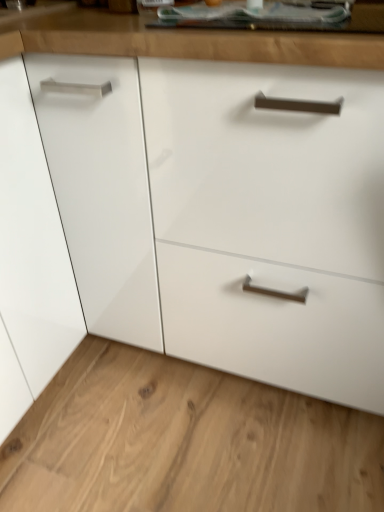
Question: Should I look upward or downward to see glossy wood counter top at upper center?

Choices:
 (A) up
 (B) down

Answer: (A)

Question: Can you confirm if glossy wood counter top at upper center is taller than white glossy drawer at lower right?

Choices:
 (A) no
 (B) yes

Answer: (B)

Question: From a real-world perspective, is glossy wood counter top at upper center located higher than white glossy drawer at lower right?

Choices:
 (A) yes
 (B) no

Answer: (A)

Question: Are glossy wood counter top at upper center and white glossy drawer at lower right far apart?

Choices:
 (A) no
 (B) yes

Answer: (A)

Question: From the image's perspective, is glossy wood counter top at upper center located beneath white glossy drawer at lower right?

Choices:
 (A) yes
 (B) no

Answer: (B)

Question: Is glossy wood counter top at upper center shorter than white glossy drawer at lower right?

Choices:
 (A) yes
 (B) no

Answer: (B)

Question: From the image's perspective, is glossy wood counter top at upper center located above white glossy drawer at lower right?

Choices:
 (A) yes
 (B) no

Answer: (A)

Question: Considering the relative sizes of white glossy drawer at lower right and glossy wood counter top at upper center in the image provided, is white glossy drawer at lower right smaller than glossy wood counter top at upper center?

Choices:
 (A) no
 (B) yes

Answer: (A)

Question: From the image's perspective, is white glossy drawer at lower right on glossy wood counter top at upper center?

Choices:
 (A) no
 (B) yes

Answer: (A)

Question: Can you confirm if white glossy drawer at lower right is taller than glossy wood counter top at upper center?

Choices:
 (A) yes
 (B) no

Answer: (B)

Question: Are white glossy drawer at lower right and glossy wood counter top at upper center making contact?

Choices:
 (A) no
 (B) yes

Answer: (A)

Question: Can you confirm if white glossy drawer at lower right is thinner than glossy wood counter top at upper center?

Choices:
 (A) yes
 (B) no

Answer: (B)

Question: Is white glossy drawer at lower right facing away from glossy wood counter top at upper center?

Choices:
 (A) no
 (B) yes

Answer: (A)

Question: Is point (296, 412) positioned closer to the camera than point (299, 50)?

Choices:
 (A) farther
 (B) closer

Answer: (A)